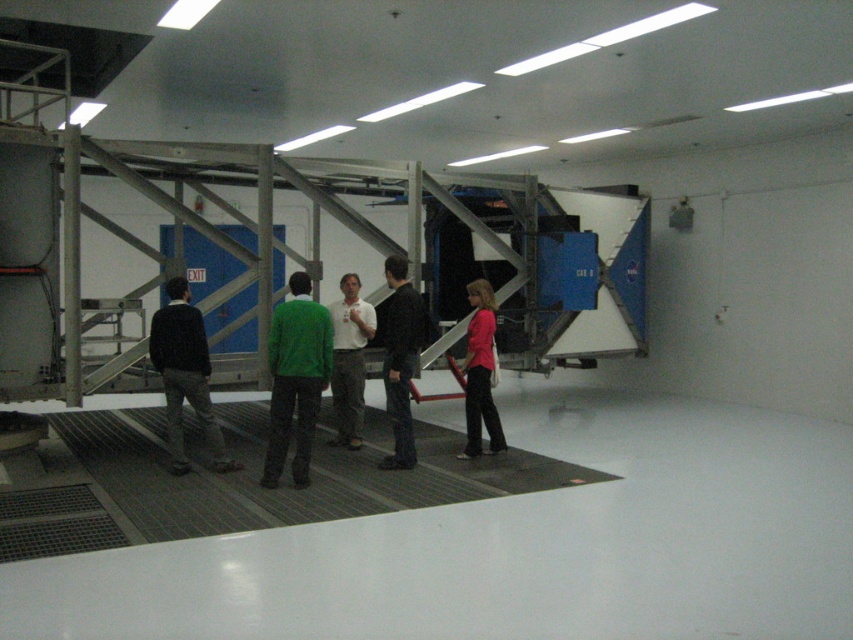
Is dark blue jeans at center shorter than pink matte shirt at center?

Incorrect, dark blue jeans at center's height does not fall short of pink matte shirt at center's.

The width and height of the screenshot is (853, 640). Find the location of `dark blue jeans at center`. dark blue jeans at center is located at coordinates (399, 358).

Find the location of a particular element. This screenshot has height=640, width=853. dark blue jeans at center is located at coordinates [x=399, y=358].

Looking at this image, between dark blue jeans at center and white shirt at center, which one appears on the right side from the viewer's perspective?

From the viewer's perspective, dark blue jeans at center appears more on the right side.

Measure the distance between dark blue jeans at center and camera.

dark blue jeans at center and camera are 20.96 feet apart.

Is point (389, 349) in front of point (357, 305)?

That is True.

At what (x,y) coordinates should I click in order to perform the action: click on dark blue jeans at center. Please return your answer as a coordinate pair (x, y). This screenshot has height=640, width=853. Looking at the image, I should click on (399, 358).

Find the location of a particular element. dark gray sweater at left is located at coordinates (184, 374).

Is dark gray sweater at left below dark blue jeans at center?

Yes, dark gray sweater at left is below dark blue jeans at center.

Is point (160, 323) farther from viewer compared to point (387, 337)?

No, it is not.

The height and width of the screenshot is (640, 853). Find the location of `dark gray sweater at left`. dark gray sweater at left is located at coordinates (184, 374).